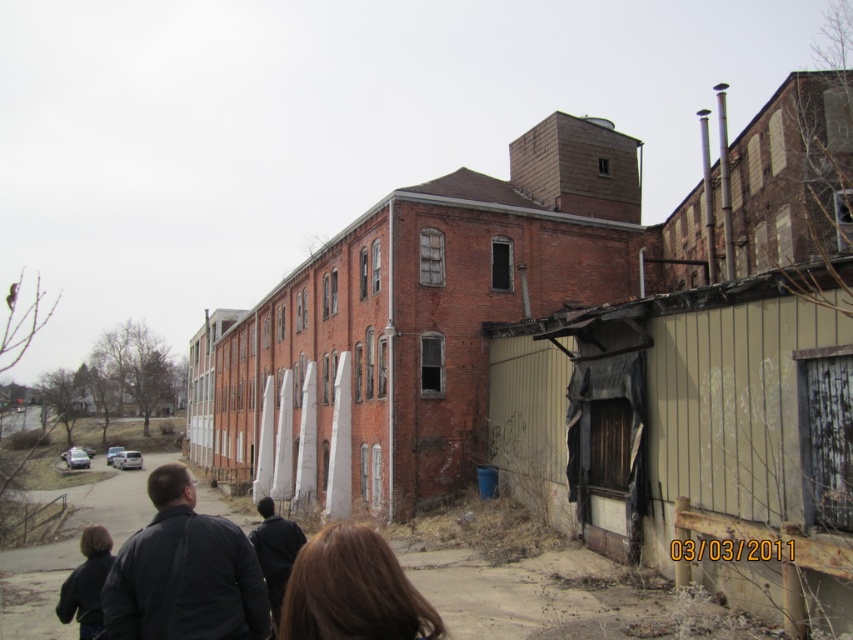
Looking at this image, you are a photographer trying to capture a shot of both the dark gray jacket at lower left and the brown hair at lower center. Which object should you focus on first if you want to ensure both are in frame without moving the camera?

The dark gray jacket at lower left is much taller than the brown hair at lower center, so you should focus on the dark gray jacket at lower left first to ensure both are in frame.

You are a photographer trying to capture a portrait of a person with brown hair at lower center and dark brown leather jacket at lower left. Which object will appear narrower in the photo?

The brown hair at lower center will appear narrower in the photo since it has a lesser width compared to the dark brown leather jacket at lower left.

You are a fashion designer observing two jackets in an urban scene. You see a dark gray jacket at lower left and a dark brown leather jacket at lower left. Which jacket is smaller in size?

The dark gray jacket at lower left has a smaller size compared to the dark brown leather jacket at lower left.